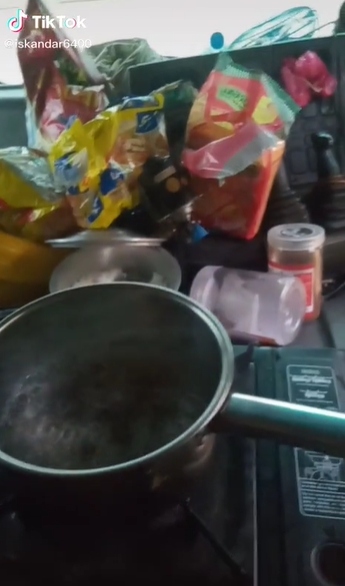
The height and width of the screenshot is (586, 345). Identify the location of burner. (187, 473).